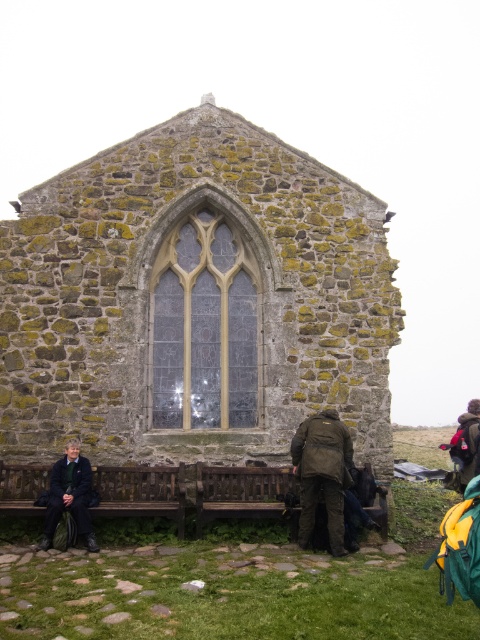
You are standing at the entrance of the old stone structure and want to sit down on the wooden bench at center. Based on its 2D coordinates, is the bench located to your left, right, or directly in front of you?

The wooden bench at center is located at coordinates 0.772 on the x axis and 0.512 on the y axis. Since the entrance is typically positioned at the front of a structure, the bench would be directly in front of you, slightly to the right.

You are standing in front of the old stone structure and want to sit down. Which object at point (x=141, y=492) is available for you to sit on?

The dark brown wooden bench at lower left is available at point (x=141, y=492) for you to sit on.